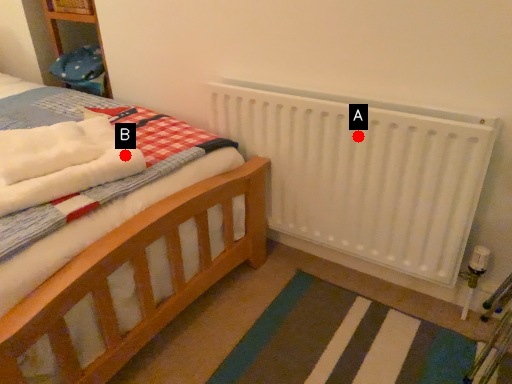
Question: Two points are circled on the image, labeled by A and B beside each circle. Which point appears closest to the camera in this image?

Choices:
 (A) A is closer
 (B) B is closer

Answer: (B)